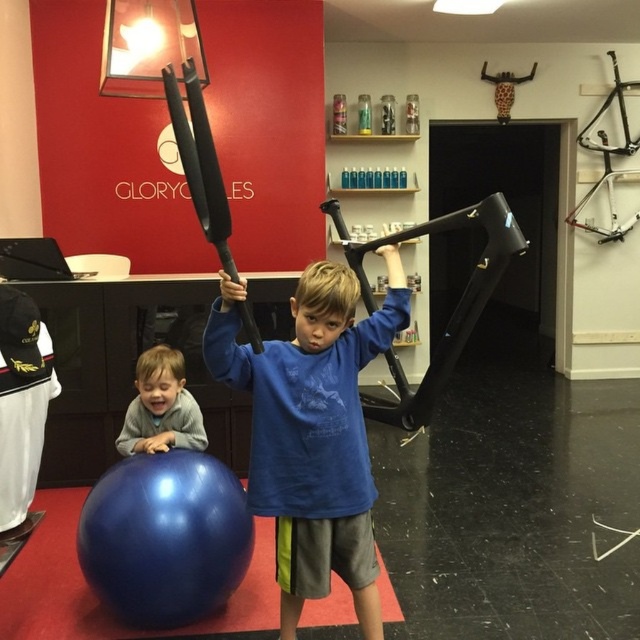
Is blue matte shirt at center shorter than gray fleece sweater at lower left?

No, blue matte shirt at center is not shorter than gray fleece sweater at lower left.

Can you confirm if blue matte shirt at center is positioned to the right of gray fleece sweater at lower left?

Correct, you'll find blue matte shirt at center to the right of gray fleece sweater at lower left.

Who is more distant from viewer, [273,492] or [140,394]?

The point [140,394] is behind.

Image resolution: width=640 pixels, height=640 pixels. I want to click on blue matte shirt at center, so click(312, 429).

Does blue matte shirt at center appear over blue rubber ball at lower left?

Yes, blue matte shirt at center is above blue rubber ball at lower left.

Describe the element at coordinates (312, 429) in the screenshot. I see `blue matte shirt at center` at that location.

This screenshot has width=640, height=640. In order to click on blue matte shirt at center in this screenshot , I will do `click(312, 429)`.

Based on the photo, does blue rubber ball at lower left come in front of gray fleece sweater at lower left?

Yes, it is.

Who is more forward, (120, 625) or (161, 429)?

Point (120, 625) is more forward.

The image size is (640, 640). What are the coordinates of `blue rubber ball at lower left` in the screenshot? It's located at (93, 593).